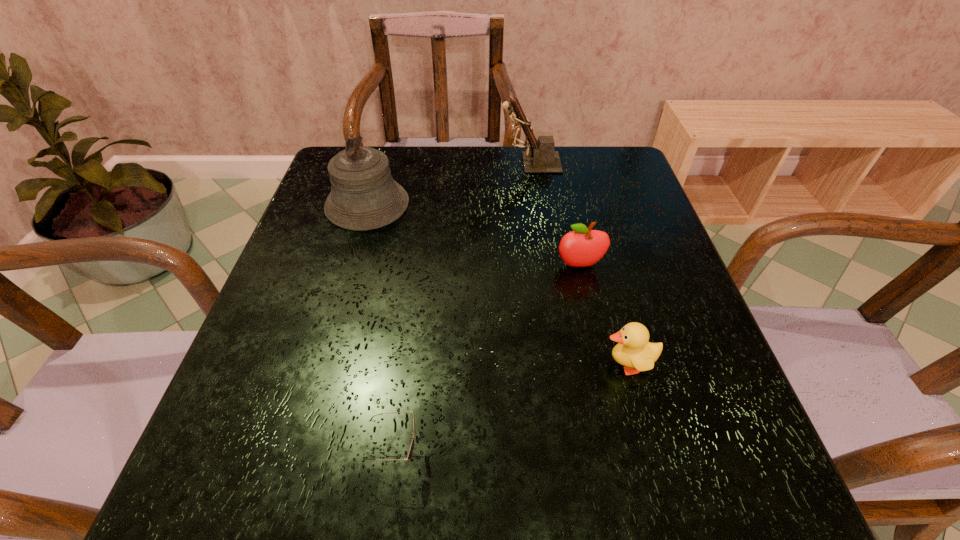
The height and width of the screenshot is (540, 960). What are the coordinates of `the farthest object` in the screenshot? It's located at click(542, 158).

Identify the location of the leftmost object. The height and width of the screenshot is (540, 960). (364, 196).

The image size is (960, 540). In order to click on the second farthest object in this screenshot , I will do `click(364, 196)`.

Locate an element on the screen. The width and height of the screenshot is (960, 540). the third farthest object is located at coordinates (581, 247).

At what (x,y) coordinates should I click in order to perform the action: click on the second nearest object. Please return your answer as a coordinate pair (x, y). The height and width of the screenshot is (540, 960). Looking at the image, I should click on (633, 350).

The width and height of the screenshot is (960, 540). What are the coordinates of `the shortest object` in the screenshot? It's located at (410, 452).

At what (x,y) coordinates should I click in order to perform the action: click on sunglasses. Please return your answer as a coordinate pair (x, y). Looking at the image, I should click on (410, 452).

Where is `free space located on the front-facing side of the farthest object`? free space located on the front-facing side of the farthest object is located at coordinates (423, 163).

Image resolution: width=960 pixels, height=540 pixels. I want to click on vacant region located on the front-facing side of the farthest object, so click(365, 163).

I want to click on vacant region located on the front-facing side of the farthest object, so click(x=448, y=163).